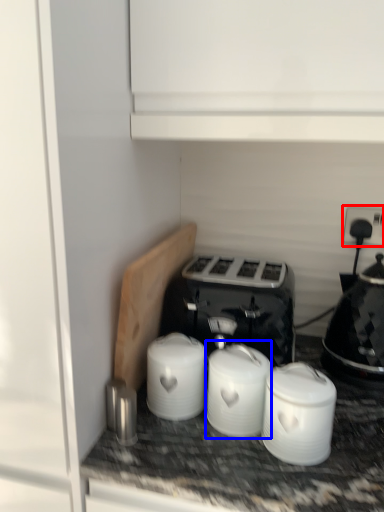
Question: Which of the following is the farthest to the observer, electric outlet (highlighted by a red box) or appliance (highlighted by a blue box)?

Choices:
 (A) electric outlet
 (B) appliance

Answer: (A)